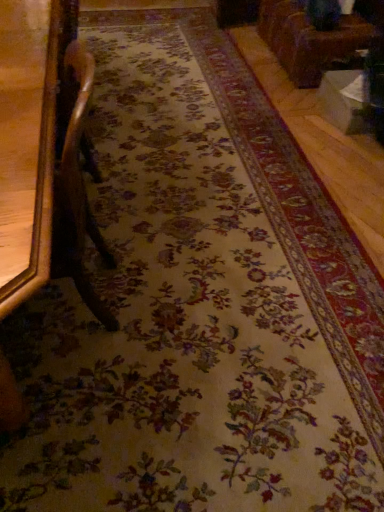
Question: Is brown leather couch at upper right, placed as the 1th furniture when sorted from top to bottom, located within brown polished wood chair at left, arranged as the first furniture when viewed from the left?

Choices:
 (A) yes
 (B) no

Answer: (B)

Question: Is the position of brown polished wood chair at left, which appears as the first furniture when viewed from the front, more distant than that of brown leather couch at upper right, the second furniture from the bottom?

Choices:
 (A) no
 (B) yes

Answer: (A)

Question: Does brown polished wood chair at left, which appears as the first furniture when viewed from the front, appear on the left side of brown leather couch at upper right, the 1th furniture in the back-to-front sequence?

Choices:
 (A) yes
 (B) no

Answer: (A)

Question: From the image's perspective, is brown polished wood chair at left, which is the second furniture in back-to-front order, over brown leather couch at upper right, the second furniture from the bottom?

Choices:
 (A) yes
 (B) no

Answer: (B)

Question: Can you confirm if brown polished wood chair at left, which is the second furniture in back-to-front order, is shorter than brown leather couch at upper right, the first furniture when ordered from right to left?

Choices:
 (A) no
 (B) yes

Answer: (A)

Question: Is brown polished wood chair at left, which is the second furniture in back-to-front order, facing away from brown leather couch at upper right, the first furniture when ordered from right to left?

Choices:
 (A) yes
 (B) no

Answer: (B)

Question: Is brown leather couch at upper right, the second furniture from the bottom, shorter than brown polished wood chair at left, which appears as the first furniture when viewed from the front?

Choices:
 (A) yes
 (B) no

Answer: (A)

Question: From the image's perspective, is brown leather couch at upper right, the first furniture when ordered from right to left, on top of brown polished wood chair at left, which appears as the first furniture when viewed from the front?

Choices:
 (A) yes
 (B) no

Answer: (A)

Question: Could you tell me if brown leather couch at upper right, the second furniture from the bottom, is facing brown polished wood chair at left, arranged as the first furniture when viewed from the left?

Choices:
 (A) no
 (B) yes

Answer: (A)

Question: Can you confirm if brown leather couch at upper right, placed as the 1th furniture when sorted from top to bottom, is positioned to the right of brown polished wood chair at left, arranged as the first furniture when viewed from the left?

Choices:
 (A) no
 (B) yes

Answer: (B)

Question: Does brown leather couch at upper right, the 1th furniture in the back-to-front sequence, have a greater width compared to brown polished wood chair at left, the 1th furniture when ordered from bottom to top?

Choices:
 (A) no
 (B) yes

Answer: (B)

Question: Does brown leather couch at upper right, the first furniture when ordered from right to left, have a greater height compared to brown polished wood chair at left, arranged as the first furniture when viewed from the left?

Choices:
 (A) no
 (B) yes

Answer: (A)

Question: In terms of size, does brown polished wood chair at left, the 1th furniture when ordered from bottom to top, appear bigger or smaller than brown leather couch at upper right, marked as the 2th furniture in a left-to-right arrangement?

Choices:
 (A) big
 (B) small

Answer: (B)